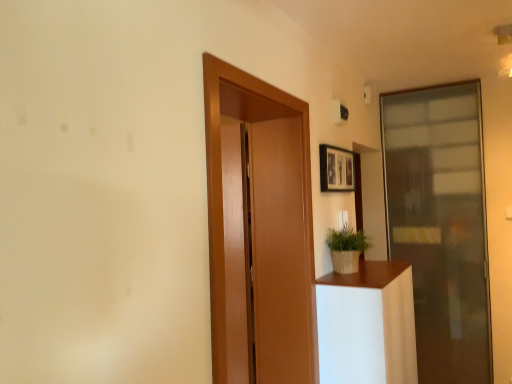
Identify the location of vacant space underneath green woven basket at right (from a real-world perspective). (350, 274).